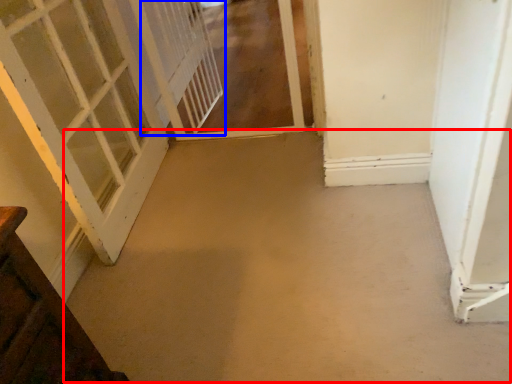
Question: Which point is further to the camera, concrete (highlighted by a red box) or screen door (highlighted by a blue box)?

Choices:
 (A) concrete
 (B) screen door

Answer: (B)